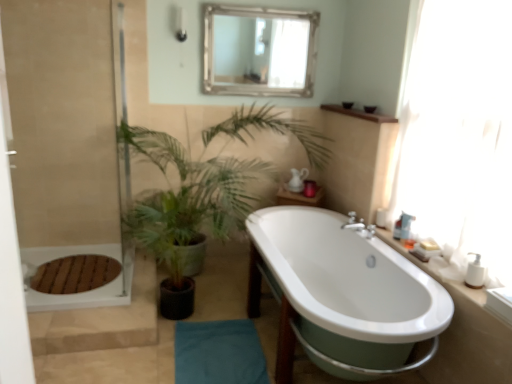
Question: Considering the relative sizes of white plastic soap dispenser at right, the 1th toiletry viewed from the back, and wooden shelf at upper center, which ranks as the second counter top in front-to-back order, in the image provided, is white plastic soap dispenser at right, the 1th toiletry viewed from the back, bigger than wooden shelf at upper center, which ranks as the second counter top in front-to-back order,?

Choices:
 (A) no
 (B) yes

Answer: (A)

Question: Are white plastic soap dispenser at right, the 3th toiletry from the front, and wooden shelf at upper center, which ranks as the second counter top in front-to-back order, far apart?

Choices:
 (A) yes
 (B) no

Answer: (B)

Question: From the image's perspective, is white plastic soap dispenser at right, arranged as the 3th toiletry when viewed from the right, located above wooden shelf at upper center, the first counter top in the back-to-front sequence?

Choices:
 (A) yes
 (B) no

Answer: (B)

Question: From a real-world perspective, is white plastic soap dispenser at right, arranged as the 3th toiletry when viewed from the right, on top of wooden shelf at upper center, the first counter top in the back-to-front sequence?

Choices:
 (A) no
 (B) yes

Answer: (A)

Question: Can we say white plastic soap dispenser at right, the 3th toiletry from the front, lies outside wooden shelf at upper center, the first counter top in the back-to-front sequence?

Choices:
 (A) no
 (B) yes

Answer: (B)

Question: Considering the positions of white plastic pump bottle at right, the third toiletry positioned from the back, and silver/golden frame mirror at upper center in the image, is white plastic pump bottle at right, the third toiletry positioned from the back, wider or thinner than silver/golden frame mirror at upper center?

Choices:
 (A) thin
 (B) wide

Answer: (A)

Question: From a real-world perspective, is white plastic pump bottle at right, which ranks as the first toiletry in front-to-back order, positioned above or below silver/golden frame mirror at upper center?

Choices:
 (A) below
 (B) above

Answer: (A)

Question: Considering the positions of white plastic pump bottle at right, which ranks as the first toiletry in right-to-left order, and silver/golden frame mirror at upper center in the image, is white plastic pump bottle at right, which ranks as the first toiletry in right-to-left order, taller or shorter than silver/golden frame mirror at upper center?

Choices:
 (A) tall
 (B) short

Answer: (B)

Question: Is white plastic pump bottle at right, which ranks as the first toiletry in right-to-left order, to the left or to the right of silver/golden frame mirror at upper center in the image?

Choices:
 (A) left
 (B) right

Answer: (B)

Question: Is green leafy plant at center inside the boundaries of white glossy bathtub at center, or outside?

Choices:
 (A) inside
 (B) outside

Answer: (B)

Question: From a real-world perspective, is green leafy plant at center physically located above or below white glossy bathtub at center?

Choices:
 (A) below
 (B) above

Answer: (B)

Question: In terms of height, does green leafy plant at center look taller or shorter compared to white glossy bathtub at center?

Choices:
 (A) short
 (B) tall

Answer: (B)

Question: Is point (190, 211) positioned closer to the camera than point (380, 299)?

Choices:
 (A) closer
 (B) farther

Answer: (B)

Question: From a real-world perspective, is white plastic pump bottle at right, which ranks as the first toiletry in right-to-left order, above or below white glossy bathtub at center?

Choices:
 (A) above
 (B) below

Answer: (A)

Question: From the image's perspective, is white plastic pump bottle at right, which ranks as the first toiletry in right-to-left order, positioned above or below white glossy bathtub at center?

Choices:
 (A) below
 (B) above

Answer: (B)